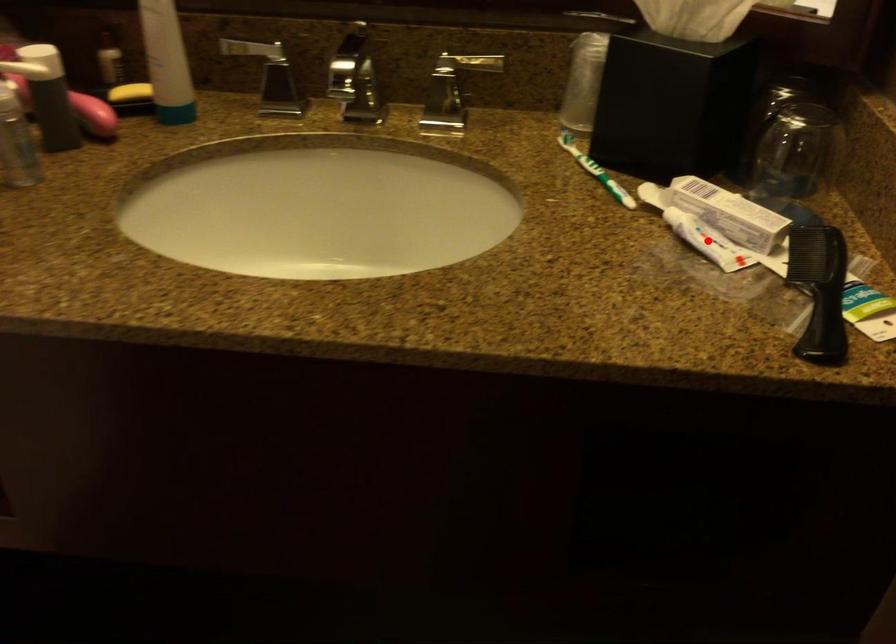
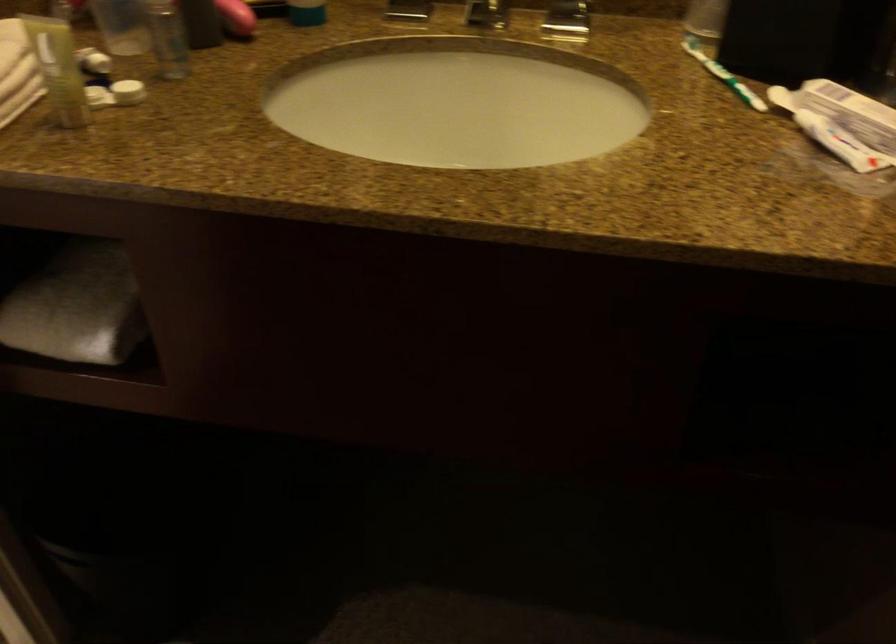
Locate, in the second image, the point that corresponds to the highlighted location in the first image.

(840, 143)